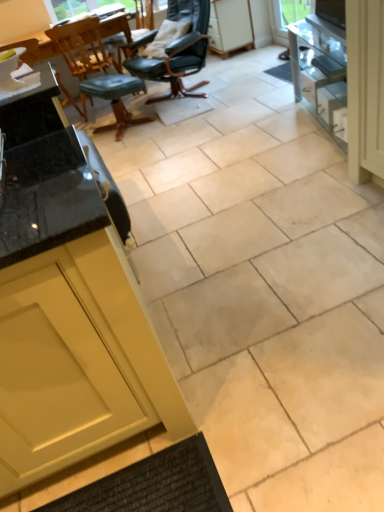
Question: Could you tell me if green leather stool at center is turned towards white glossy drawer at right?

Choices:
 (A) no
 (B) yes

Answer: (A)

Question: Does green leather stool at center come behind white glossy drawer at right?

Choices:
 (A) yes
 (B) no

Answer: (A)

Question: Is white glossy drawer at right a part of green leather stool at center?

Choices:
 (A) no
 (B) yes

Answer: (A)

Question: Can you confirm if green leather stool at center is wider than white glossy drawer at right?

Choices:
 (A) no
 (B) yes

Answer: (B)

Question: Is green leather stool at center facing away from white glossy drawer at right?

Choices:
 (A) no
 (B) yes

Answer: (A)

Question: Considering the relative sizes of green leather stool at center and white glossy drawer at right in the image provided, is green leather stool at center bigger than white glossy drawer at right?

Choices:
 (A) no
 (B) yes

Answer: (B)

Question: Does matte black chair at left, which is counted as the first chair, starting from the left, have a greater width compared to green leather stool at center?

Choices:
 (A) yes
 (B) no

Answer: (A)

Question: Is the surface of matte black chair at left, which is counted as the first chair, starting from the left, in direct contact with green leather stool at center?

Choices:
 (A) yes
 (B) no

Answer: (B)

Question: Does matte black chair at left, the third chair in the right-to-left sequence, have a lesser height compared to green leather stool at center?

Choices:
 (A) yes
 (B) no

Answer: (B)

Question: Is matte black chair at left, the third chair in the right-to-left sequence, looking in the opposite direction of green leather stool at center?

Choices:
 (A) yes
 (B) no

Answer: (B)

Question: Considering the relative positions of matte black chair at left, which is counted as the first chair, starting from the left, and green leather stool at center in the image provided, is matte black chair at left, which is counted as the first chair, starting from the left, behind green leather stool at center?

Choices:
 (A) yes
 (B) no

Answer: (A)

Question: Is matte black chair at left, which is counted as the first chair, starting from the left, aimed at green leather stool at center?

Choices:
 (A) no
 (B) yes

Answer: (A)

Question: Is leather-like black chair at upper center, positioned as the 1th chair in right-to-left order, at the right side of wooden chair at upper left, which is counted as the 2th chair, starting from the right?

Choices:
 (A) yes
 (B) no

Answer: (A)